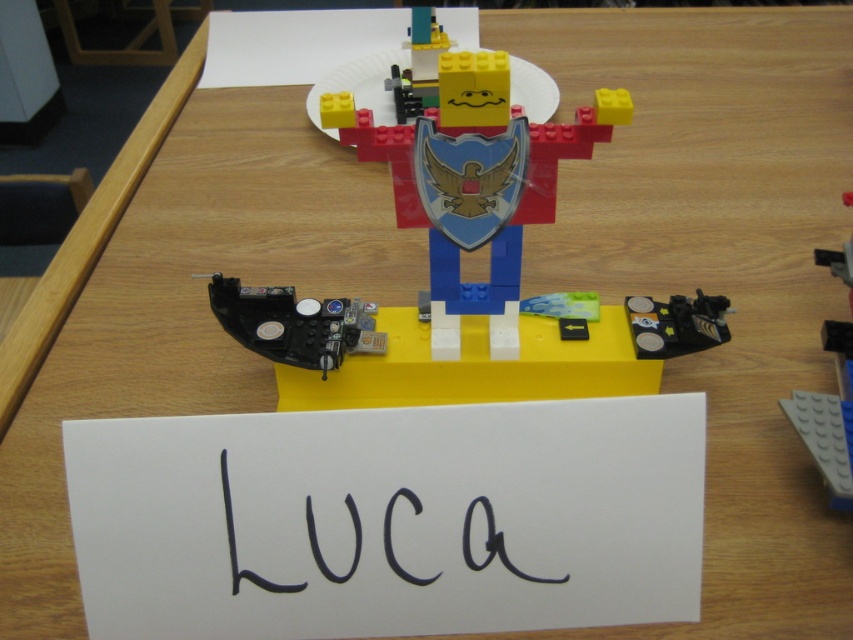
What is located at the coordinates point (479, 300) in the LEGO creation?

The matte plastic figure at center is located at point (479, 300).

You are a robot trying to locate the black plastic control panel at lower center. From the LEGO figure standing on the yellow base, in which direction should you move to reach the control panel?

The black plastic control panel at lower center is located at point (294, 323), so you should move towards the lower center direction from the LEGO figure to reach it.

You are a photographer trying to capture a clear shot of the matte plastic figure at center and the yellow matte lego head at upper center. Which object will appear larger in your photo?

The matte plastic figure at center will appear larger in the photo because it is closer to the viewer than the yellow matte lego head at upper center.